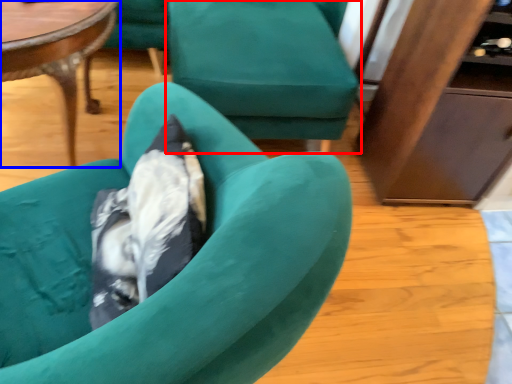
Question: Which point is closer to the camera, chair (highlighted by a red box) or coffee table (highlighted by a blue box)?

Choices:
 (A) chair
 (B) coffee table

Answer: (B)